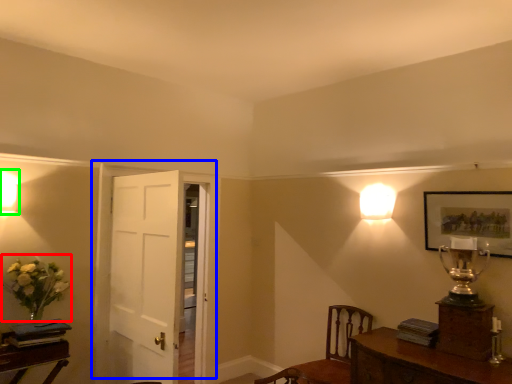
Question: Which is farther away from floral arrangement (highlighted by a red box)? door (highlighted by a blue box) or lamp (highlighted by a green box)?

Choices:
 (A) door
 (B) lamp

Answer: (A)